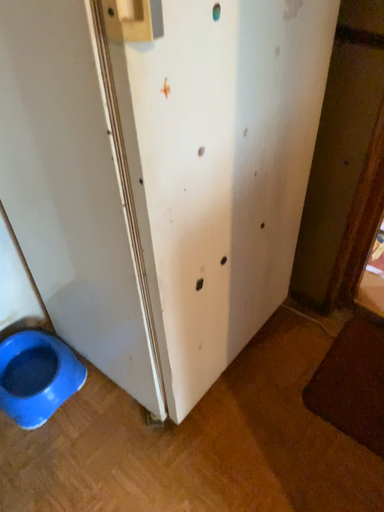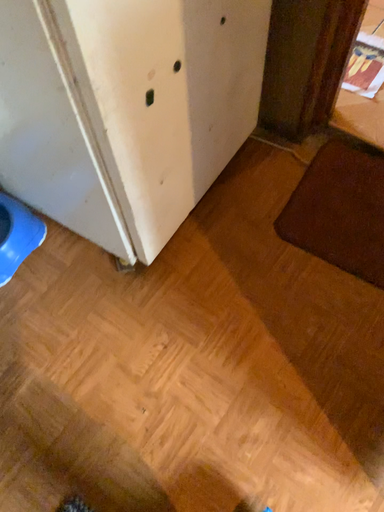
Question: Which way did the camera rotate in the video?

Choices:
 (A) rotated upward
 (B) rotated downward

Answer: (B)